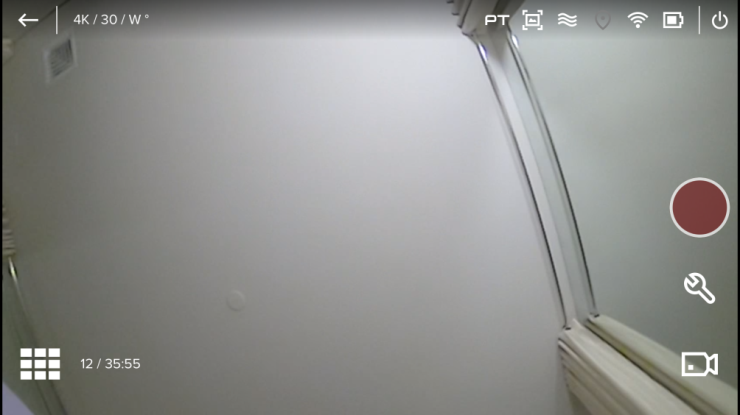
This screenshot has width=740, height=415. Identify the location of wall. (331, 219).